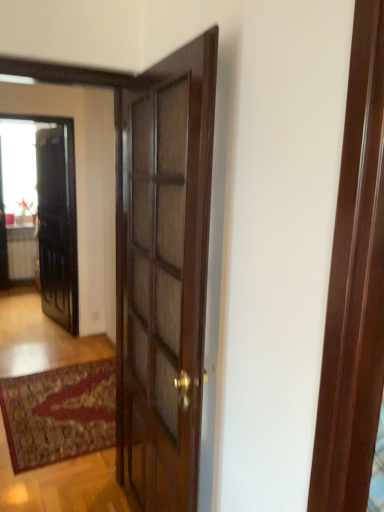
Measure the distance between point (7, 212) and camera.

Point (7, 212) is 5.18 meters from camera.

Describe the element at coordinates (22, 257) in the screenshot. I see `white glossy radiator at lower left` at that location.

At what (x,y) coordinates should I click in order to perform the action: click on black glossy elevator at left. Please return your answer as a coordinate pair (x, y). The image size is (384, 512). Looking at the image, I should click on (57, 216).

At what (x,y) coordinates should I click in order to perform the action: click on transparent glass window at upper left. Please return your answer as a coordinate pair (x, y). Looking at the image, I should click on (18, 166).

Can you tell me how much black glossy elevator at left and glossy dark wood door at center differ in facing direction?

The angle between the facing direction of black glossy elevator at left and the facing direction of glossy dark wood door at center is 80 degrees.

Does black glossy elevator at left contain glossy dark wood door at center?

No, black glossy elevator at left does not contain glossy dark wood door at center.

Who is bigger, black glossy elevator at left or glossy dark wood door at center?

glossy dark wood door at center.

Between black glossy elevator at left and glossy dark wood door at center, which one has less height?

glossy dark wood door at center.

Considering the relative sizes of white glossy radiator at lower left and glossy dark wood door at center in the image provided, is white glossy radiator at lower left bigger than glossy dark wood door at center?

No, white glossy radiator at lower left is not bigger than glossy dark wood door at center.

From a real-world perspective, is white glossy radiator at lower left over glossy dark wood door at center?

No.

What are the coordinates of `radiator located on the left of glossy dark wood door at center` in the screenshot? It's located at (22, 257).

Is transparent glass window at upper left in front of or behind white glossy radiator at lower left in the image?

In the image, transparent glass window at upper left appears behind white glossy radiator at lower left.

Considering the sizes of objects transparent glass window at upper left and white glossy radiator at lower left in the image provided, who is taller, transparent glass window at upper left or white glossy radiator at lower left?

With more height is transparent glass window at upper left.

Which of these two, transparent glass window at upper left or white glossy radiator at lower left, is thinner?

transparent glass window at upper left is thinner.

Is transparent glass window at upper left positioned with its back to white glossy radiator at lower left?

transparent glass window at upper left does not have its back to white glossy radiator at lower left.

Is point (14, 254) closer to camera compared to point (43, 195)?

No, it is behind (43, 195).

Is white glossy radiator at lower left situated inside black glossy elevator at left or outside?

white glossy radiator at lower left lies outside black glossy elevator at left.

From the picture: Does white glossy radiator at lower left appear on the right side of black glossy elevator at left?

In fact, white glossy radiator at lower left is to the left of black glossy elevator at left.

How different are the orientations of white glossy radiator at lower left and black glossy elevator at left in degrees?

The angle between the facing direction of white glossy radiator at lower left and the facing direction of black glossy elevator at left is 0.154 degrees.

Is there a large distance between glossy dark wood door at center and transparent glass window at upper left?

No, there isn't a large distance between glossy dark wood door at center and transparent glass window at upper left.

Could you tell me if glossy dark wood door at center is facing transparent glass window at upper left?

No, glossy dark wood door at center is not aimed at transparent glass window at upper left.

Considering the sizes of objects glossy dark wood door at center and transparent glass window at upper left in the image provided, who is smaller, glossy dark wood door at center or transparent glass window at upper left?

transparent glass window at upper left is smaller.

From the image's perspective, relative to transparent glass window at upper left, is glossy dark wood door at center above or below?

Based on their image positions, glossy dark wood door at center is located beneath transparent glass window at upper left.

Is black glossy elevator at left turned away from transparent glass window at upper left?

Yes, black glossy elevator at left is facing away from transparent glass window at upper left.

Can you confirm if black glossy elevator at left is bigger than transparent glass window at upper left?

Yes, black glossy elevator at left is bigger than transparent glass window at upper left.

Which is more to the right, black glossy elevator at left or transparent glass window at upper left?

black glossy elevator at left is more to the right.

Who is shorter, black glossy elevator at left or transparent glass window at upper left?

With less height is transparent glass window at upper left.

Is glossy dark wood door at center to the left of black glossy elevator at left from the viewer's perspective?

Correct, you'll find glossy dark wood door at center to the left of black glossy elevator at left.

Locate an element on the screen. This screenshot has width=384, height=512. elevator that appears below the glossy dark wood door at center (from the image's perspective) is located at coordinates click(x=57, y=216).

How many degrees apart are the facing directions of glossy dark wood door at center and black glossy elevator at left?

80 degrees.

Who is shorter, glossy dark wood door at center or black glossy elevator at left?

With less height is glossy dark wood door at center.

The width and height of the screenshot is (384, 512). Find the location of `elevator lying below the glossy dark wood door at center (from the image's perspective)`. elevator lying below the glossy dark wood door at center (from the image's perspective) is located at coordinates (57, 216).

You are a GUI agent. You are given a task and a screenshot of the screen. Output one action in this format:
    pyautogui.click(x=<x>, y=<y>)
    Task: Click on the door on the right of white glossy radiator at lower left
    This screenshot has height=512, width=384.
    Given the screenshot: What is the action you would take?
    pyautogui.click(x=58, y=222)

Looking at the image, which one is located closer to glossy dark wood door at center, white glossy radiator at lower left or black glossy elevator at left?

Among the two, black glossy elevator at left is located nearer to glossy dark wood door at center.

From the image, which object appears to be farther from white glossy radiator at lower left, black glossy elevator at left or glossy dark wood door at center?

black glossy elevator at left.

Which object lies nearer to the anchor point glossy dark wood door at center, white glossy radiator at lower left or transparent glass window at upper left?

transparent glass window at upper left.

Based on their spatial positions, is white glossy radiator at lower left or glossy dark wood door at center closer to black glossy elevator at left?

glossy dark wood door at center is closer to black glossy elevator at left.

Looking at the image, which one is located closer to black glossy elevator at left, white glossy radiator at lower left or transparent glass window at upper left?

The object closer to black glossy elevator at left is transparent glass window at upper left.

Which object lies further to the anchor point transparent glass window at upper left, black glossy elevator at left or glossy dark wood door at center?

The object further to transparent glass window at upper left is black glossy elevator at left.

When comparing their distances from black glossy elevator at left, does transparent glass window at upper left or glossy dark wood door at center seem closer?

glossy dark wood door at center is positioned closer to the anchor black glossy elevator at left.

Considering their positions, is black glossy elevator at left positioned closer to transparent glass window at upper left than white glossy radiator at lower left?

Among the two, white glossy radiator at lower left is located nearer to transparent glass window at upper left.

What are the coordinates of `door between black glossy elevator at left and white glossy radiator at lower left from front to back` in the screenshot? It's located at (58, 222).

Identify the location of radiator between black glossy elevator at left and transparent glass window at upper left from front to back. (22, 257).

Locate an element on the screen. door between black glossy elevator at left and transparent glass window at upper left along the z-axis is located at coordinates (58, 222).

This screenshot has width=384, height=512. Find the location of `radiator positioned between glossy dark wood door at center and transparent glass window at upper left from near to far`. radiator positioned between glossy dark wood door at center and transparent glass window at upper left from near to far is located at coordinates (22, 257).